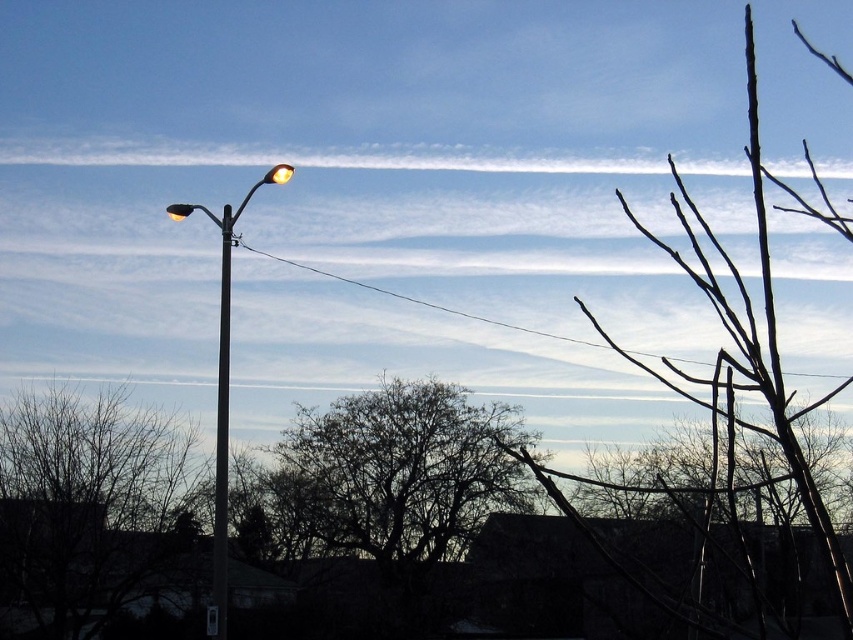
Question: Can you confirm if silhouette leafless tree at center is wider than matte yellow streetlight at upper center?

Choices:
 (A) yes
 (B) no

Answer: (A)

Question: Which point is closer to the camera taking this photo?

Choices:
 (A) (38, 540)
 (B) (274, 172)

Answer: (B)

Question: Observing the image, what is the correct spatial positioning of metallic pole at left in reference to matte yellow streetlight at upper center?

Choices:
 (A) above
 (B) below

Answer: (B)

Question: Which object is positioned farthest from the matte yellow streetlight at upper center?

Choices:
 (A) matte yellow streetlight at upper left
 (B) brown bare branches at center

Answer: (B)

Question: Which of the following is the closest to the observer?

Choices:
 (A) (287, 173)
 (B) (186, 212)
 (C) (202, 208)

Answer: (A)

Question: Can you confirm if matte yellow streetlight at upper center is thinner than matte yellow streetlight at upper left?

Choices:
 (A) yes
 (B) no

Answer: (A)